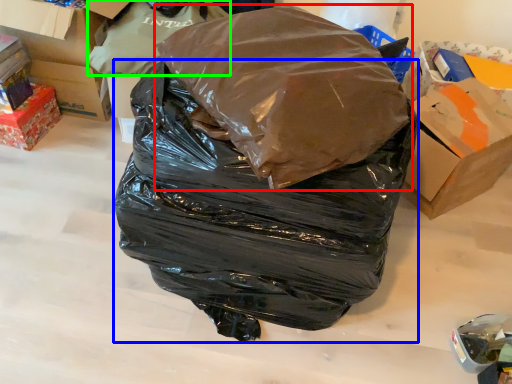
Question: Which object is the farthest from plastic bag (highlighted by a red box)? Choose among these: plastic bag (highlighted by a blue box) or plastic bag (highlighted by a green box).

Choices:
 (A) plastic bag
 (B) plastic bag

Answer: (B)